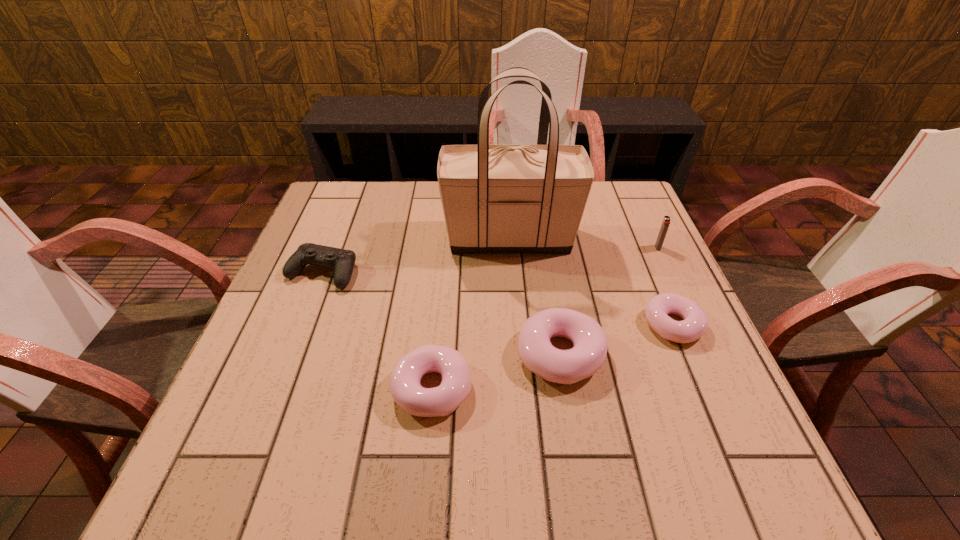
This screenshot has height=540, width=960. I want to click on the second tallest doughnut, so click(405, 381).

Locate an element on the screen. the second doughnut from left to right is located at coordinates (587, 356).

The height and width of the screenshot is (540, 960). Find the location of `the shortest object`. the shortest object is located at coordinates (695, 322).

Where is `the shortest doughnut`? The height and width of the screenshot is (540, 960). the shortest doughnut is located at coordinates (695, 322).

Identify the location of shopping bag. (496, 198).

The width and height of the screenshot is (960, 540). Find the location of `the fifth shortest object`. the fifth shortest object is located at coordinates (666, 221).

Locate an element on the screen. The height and width of the screenshot is (540, 960). control is located at coordinates (342, 261).

Identify the location of vacant space located on the back of the leftmost doughnut. The image size is (960, 540). (445, 248).

The image size is (960, 540). In order to click on vacant space situated 0.060m on the front of the second doughnut from right to left in this screenshot , I will do `click(571, 422)`.

I want to click on free space located 0.330m on the back of the shortest object, so click(628, 218).